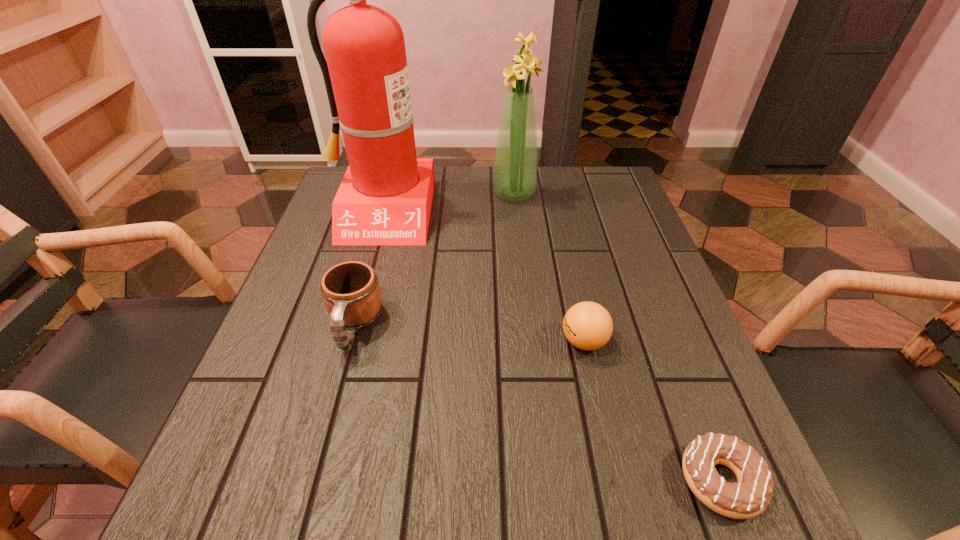
Locate an element on the screen. vacant space located on the front-facing side of the bouquet is located at coordinates (415, 194).

Identify the location of vacant position located on the side of the mug with the handle. The height and width of the screenshot is (540, 960). (324, 435).

Locate an element on the screen. Image resolution: width=960 pixels, height=540 pixels. vacant space situated on the side with brand of the ping-pong ball is located at coordinates (414, 341).

In order to click on free point located 0.260m on the side with brand of the ping-pong ball in this screenshot , I will do `click(420, 341)`.

What are the coordinates of `blank area located 0.300m on the side with brand of the ping-pong ball` in the screenshot? It's located at (397, 341).

The width and height of the screenshot is (960, 540). In order to click on free point located 0.330m on the left of the rightmost object in this screenshot , I will do `click(450, 481)`.

In order to click on fire extinguisher positioned at the far edge in this screenshot , I will do `click(385, 198)`.

Identify the location of bouquet at the far edge. (515, 167).

Find the location of a particular element. Image resolution: width=960 pixels, height=540 pixels. object at the near edge is located at coordinates (750, 496).

Locate an element on the screen. fire extinguisher at the left edge is located at coordinates (385, 198).